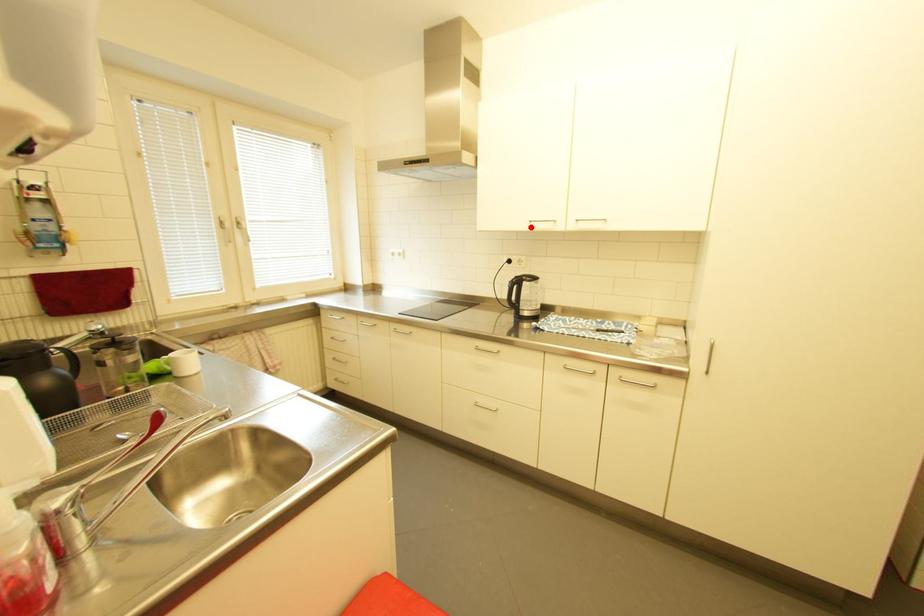
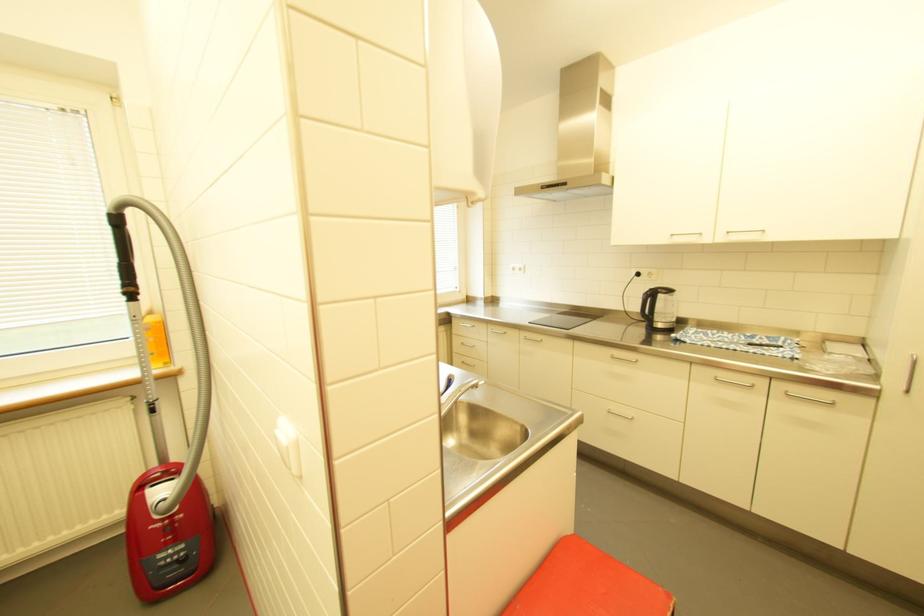
In the second image, find the point that corresponds to the highlighted location in the first image.

(671, 241)